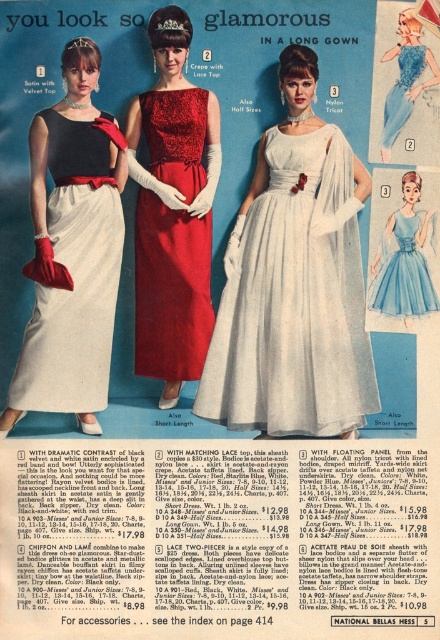
Question: Is white nylon dress at center behind matte nylon dress at center?

Choices:
 (A) yes
 (B) no

Answer: (A)

Question: Which point is closer to the camera taking this photo?

Choices:
 (A) (391, 128)
 (B) (252, 256)
 (C) (150, 236)
 (D) (428, 291)

Answer: (A)

Question: Where is white nylon dress at center located in relation to light blue satin dress at center in the image?

Choices:
 (A) right
 (B) left

Answer: (B)

Question: Can you confirm if white nylon dress at center is thinner than light blue satin dress at center?

Choices:
 (A) yes
 (B) no

Answer: (B)

Question: Among these objects, which one is farthest from the camera?

Choices:
 (A) matte black velvet top at left
 (B) white nylon dress at center
 (C) light blue satin dress at center

Answer: (C)

Question: Among these objects, which one is nearest to the camera?

Choices:
 (A) matte red lace dress at center
 (B) matte black velvet top at left
 (C) light blue satin dress at center
 (D) white nylon dress at center

Answer: (A)